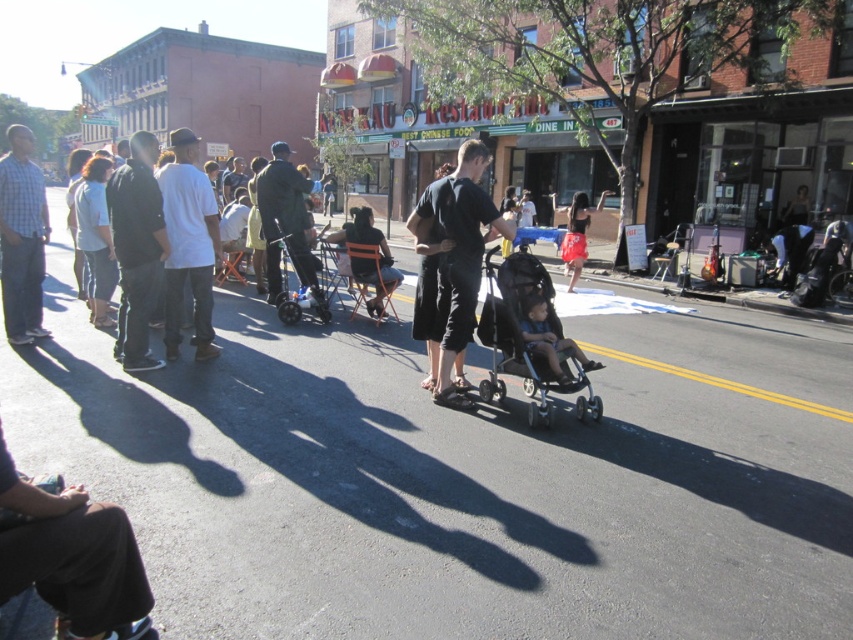
Question: Which of the following is the closest to the observer?

Choices:
 (A) (129, 266)
 (B) (541, 349)

Answer: (B)

Question: From the image, what is the correct spatial relationship of black matte stroller at center in relation to black leather jacket at left?

Choices:
 (A) right
 (B) left

Answer: (A)

Question: Which point is closer to the camera?

Choices:
 (A) (576, 362)
 (B) (148, 154)
 (C) (231, 161)

Answer: (A)

Question: Is black matte stroller at center closer to camera compared to green matte jacket at center?

Choices:
 (A) yes
 (B) no

Answer: (A)

Question: Based on their relative distances, which object is nearer to the dark gray pants at center?

Choices:
 (A) white matte shirt at center
 (B) black leather jacket at left
 (C) black matte stroller at center

Answer: (A)

Question: Does black matte stroller at center have a larger size compared to black leather jacket at left?

Choices:
 (A) no
 (B) yes

Answer: (A)